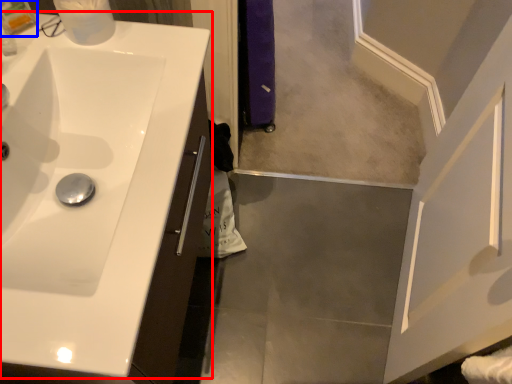
Question: Among these objects, which one is farthest to the camera, sink (highlighted by a red box) or toiletry (highlighted by a blue box)?

Choices:
 (A) sink
 (B) toiletry

Answer: (B)